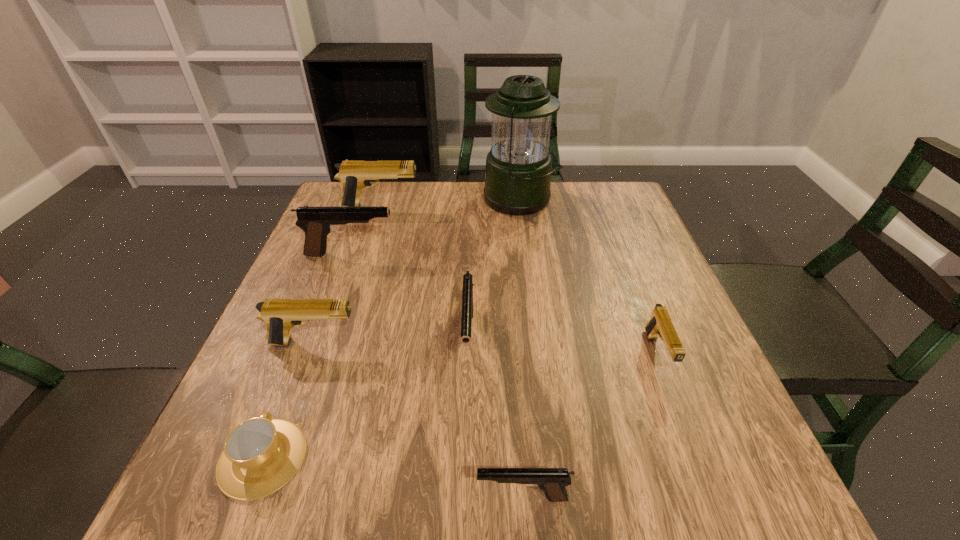
Find the location of a particular element. vacant region located at the barrel of the smallest tan pistol is located at coordinates (678, 408).

You are a GUI agent. You are given a task and a screenshot of the screen. Output one action in this format:
    pyautogui.click(x=<x>, y=<y>)
    Task: Click on the free space located 0.060m at the muzzle of the rightmost black pistol
    The image size is (960, 540).
    Given the screenshot: What is the action you would take?
    pyautogui.click(x=436, y=498)

You are a GUI agent. You are given a task and a screenshot of the screen. Output one action in this format:
    pyautogui.click(x=<x>, y=<y>)
    Task: Click on the free spot located at the muzzle of the rightmost black pistol
    
    Given the screenshot: What is the action you would take?
    pyautogui.click(x=375, y=498)

Identify the location of vacant position located 0.400m at the muzzle of the rightmost black pistol. (205, 498).

Locate an element on the screen. The height and width of the screenshot is (540, 960). vacant space located 0.280m with the handle on the side of the cup is located at coordinates (322, 305).

Where is `vacant space situated with the handle on the side of the cup`? The image size is (960, 540). vacant space situated with the handle on the side of the cup is located at coordinates (308, 339).

Identify the location of vacant area situated 0.240m with the handle on the side of the cup. (317, 318).

Locate an element on the screen. This screenshot has height=540, width=960. lantern that is at the far edge is located at coordinates (518, 172).

Find the location of a particular element. The image size is (960, 540). pistol that is at the far edge is located at coordinates (354, 175).

Find the location of a particular element. pistol present at the near edge is located at coordinates point(552,481).